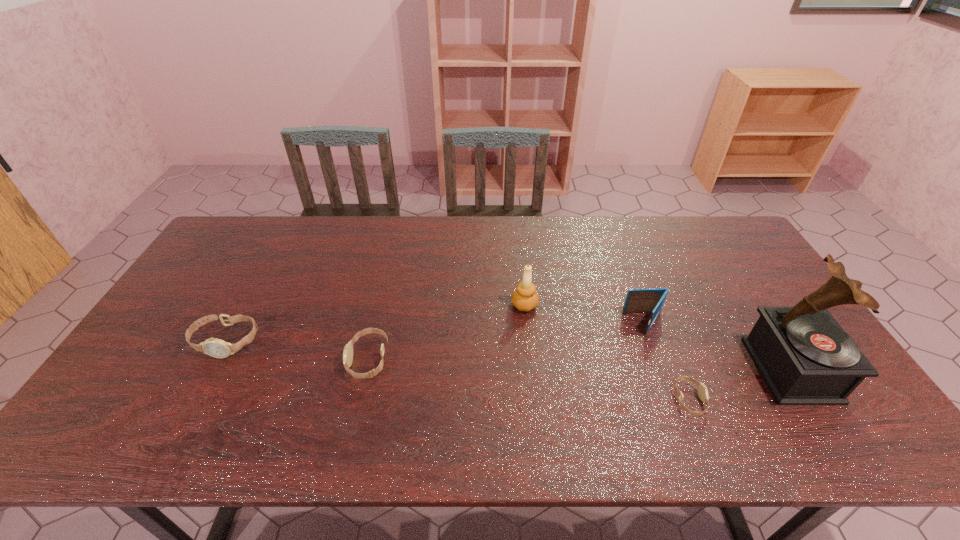
Where is `vacant space in between the second watch from right to left and the rightmost object`? This screenshot has height=540, width=960. vacant space in between the second watch from right to left and the rightmost object is located at coordinates (580, 364).

In order to click on vacant area between the rightmost object and the fourth object from right to left in this screenshot , I will do `click(658, 338)`.

Point out which object is positioned as the nearest to the fifth shortest object. Please provide its 2D coordinates. Your answer should be formatted as a tuple, i.e. [(x, y)], where the tuple contains the x and y coordinates of a point satisfying the conditions above.

[(652, 300)]

Image resolution: width=960 pixels, height=540 pixels. Find the location of `object that is the second closest to the leftmost object`. object that is the second closest to the leftmost object is located at coordinates (524, 298).

Locate which watch is the closest to the wallet. Please provide its 2D coordinates. Your answer should be formatted as a tuple, i.e. [(x, y)], where the tuple contains the x and y coordinates of a point satisfying the conditions above.

[(702, 389)]

Identify which watch is the third nearest to the tallest object. Please provide its 2D coordinates. Your answer should be formatted as a tuple, i.e. [(x, y)], where the tuple contains the x and y coordinates of a point satisfying the conditions above.

[(217, 348)]

Image resolution: width=960 pixels, height=540 pixels. Find the location of `free region that satisfies the following two spatial constraints: 1. on the exterior surface of the wallet; 2. on the face of the leftmost watch`. free region that satisfies the following two spatial constraints: 1. on the exterior surface of the wallet; 2. on the face of the leftmost watch is located at coordinates (652, 342).